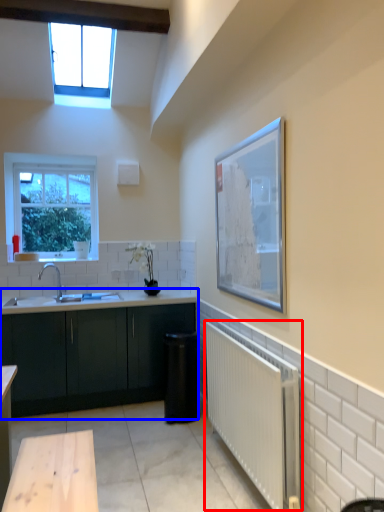
Question: Which of the following is the closest to the observer, radiator (highlighted by a red box) or cabinetry (highlighted by a blue box)?

Choices:
 (A) radiator
 (B) cabinetry

Answer: (A)